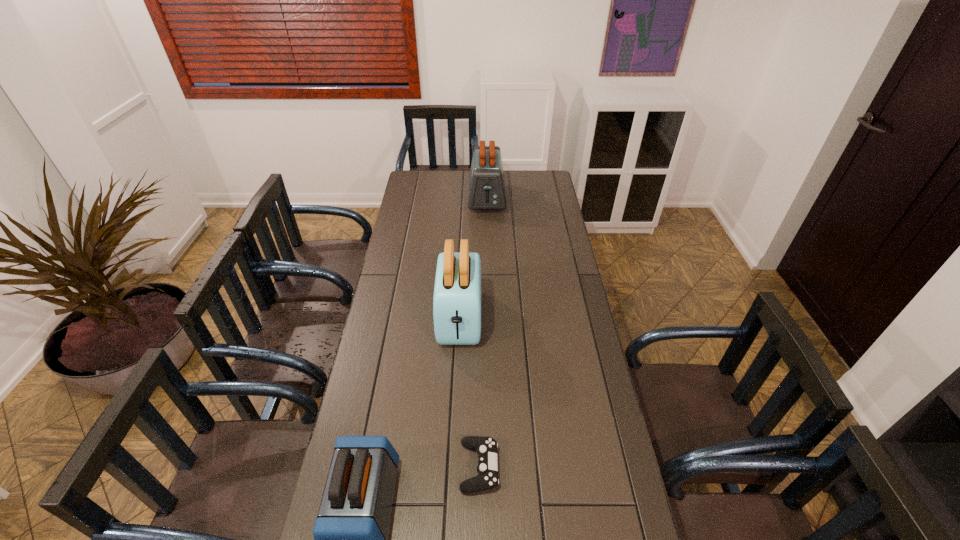
Locate an element on the screen. The height and width of the screenshot is (540, 960). empty space that is in between the shortest object and the third nearest object is located at coordinates (469, 393).

Locate an element on the screen. The image size is (960, 540). free space between the second farthest object and the control is located at coordinates (469, 393).

Locate an element on the screen. The image size is (960, 540). vacant point located between the farthest object and the shortest object is located at coordinates (483, 333).

I want to click on free space between the farthest toaster and the shortest object, so click(483, 333).

This screenshot has width=960, height=540. I want to click on free space between the farthest toaster and the shortest object, so click(483, 333).

Identify which object is the closest to the shortest object. Please provide its 2D coordinates. Your answer should be formatted as a tuple, i.e. [(x, y)], where the tuple contains the x and y coordinates of a point satisfying the conditions above.

[(350, 534)]

This screenshot has height=540, width=960. I want to click on object identified as the third closest to the shortest object, so [486, 190].

Where is `the closest toaster relative to the control`? This screenshot has height=540, width=960. the closest toaster relative to the control is located at coordinates (350, 534).

Select which toaster appears as the closest to the shortest object. Please provide its 2D coordinates. Your answer should be formatted as a tuple, i.e. [(x, y)], where the tuple contains the x and y coordinates of a point satisfying the conditions above.

[(350, 534)]

I want to click on free space that satisfies the following two spatial constraints: 1. on the front-facing side of the farthest toaster; 2. on the surface of the control, so click(x=492, y=467).